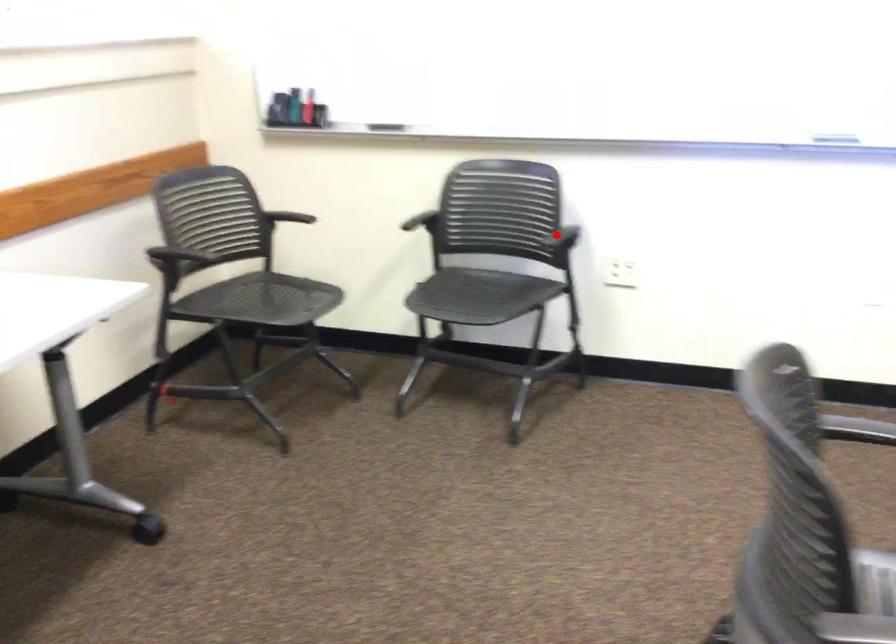
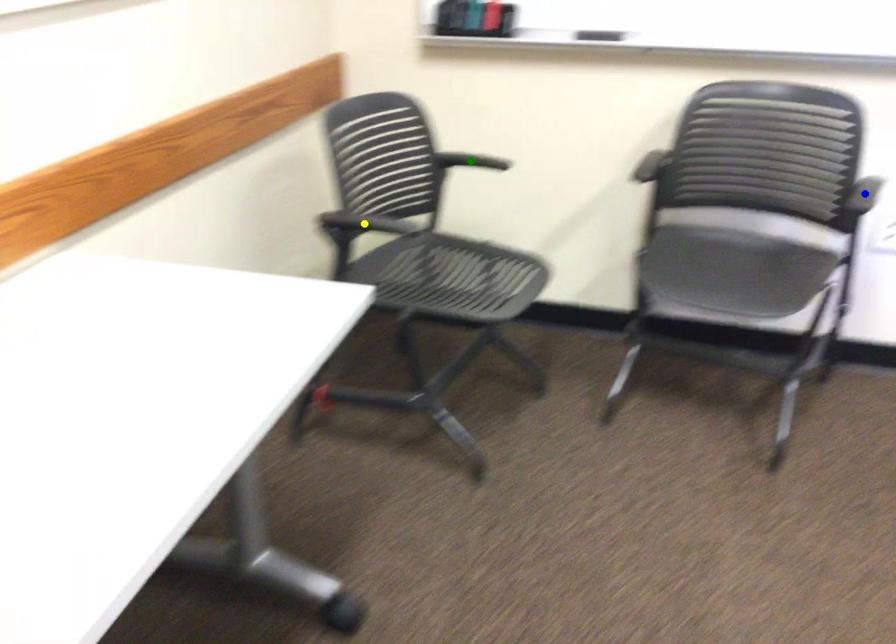
Question: I am providing you with two images of the same scene from different viewpoints. A red point is marked on the first image. You are given multiple points on the second image. Which mark in image 2 goes with the point in image 1?

Choices:
 (A) green point
 (B) yellow point
 (C) blue point

Answer: (C)